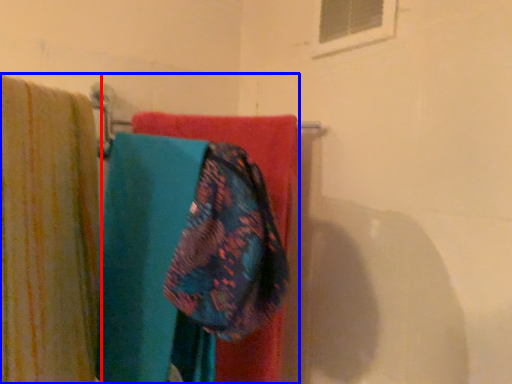
Question: Which object is closer to the camera taking this photo, curtain (highlighted by a red box) or laundry (highlighted by a blue box)?

Choices:
 (A) curtain
 (B) laundry

Answer: (A)